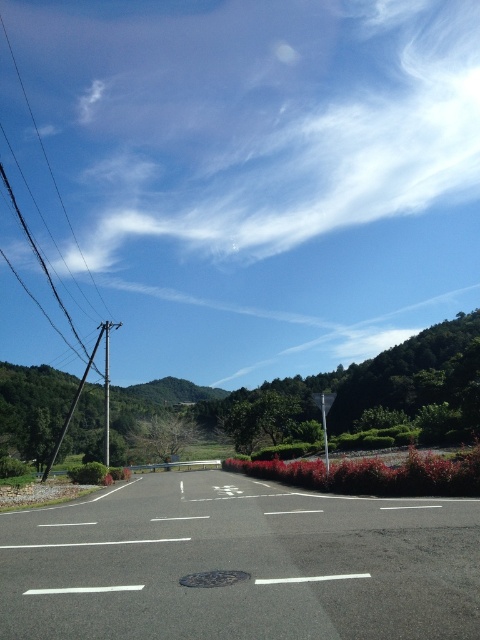
Question: Observing the image, what is the correct spatial positioning of metallic wire at left in reference to smooth metallic pole at left?

Choices:
 (A) below
 (B) above

Answer: (B)

Question: Is metallic wire at left positioned in front of metallic pole at left?

Choices:
 (A) yes
 (B) no

Answer: (B)

Question: Which point is closer to the camera?

Choices:
 (A) smooth metallic pole at left
 (B) metallic pole at left

Answer: (A)

Question: Can you confirm if metallic wire at left is positioned to the left of metallic pole at left?

Choices:
 (A) no
 (B) yes

Answer: (B)

Question: Considering the real-world distances, which object is farthest from the metallic wire at left?

Choices:
 (A) metallic pole at left
 (B) smooth metallic pole at left

Answer: (A)

Question: Estimate the real-world distances between objects in this image. Which object is farther from the smooth metallic pole at left?

Choices:
 (A) metallic pole at left
 (B) metallic wire at left

Answer: (B)